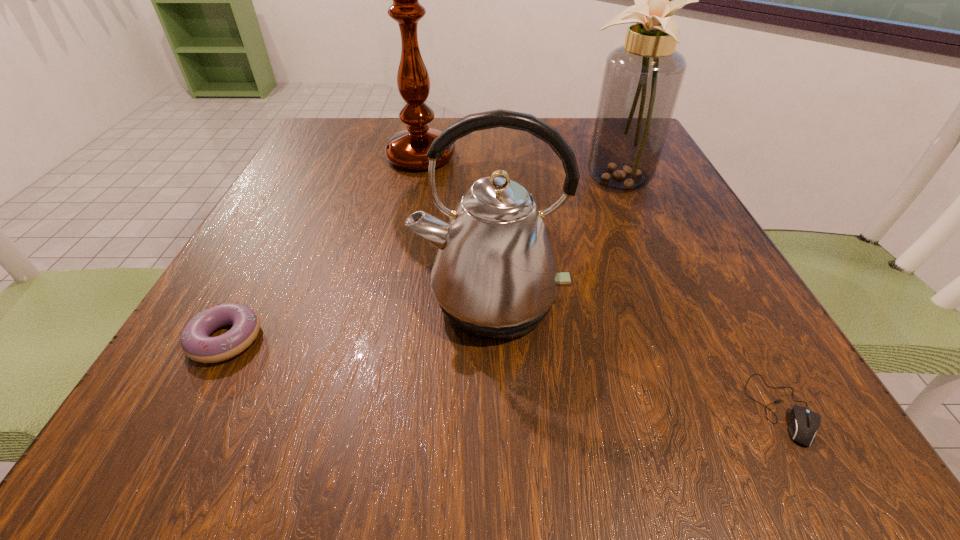
You are a GUI agent. You are given a task and a screenshot of the screen. Output one action in this format:
    pyautogui.click(x=<x>, y=<y>)
    Task: Click on the object located at the far right corner
    Image resolution: width=960 pixels, height=540 pixels.
    Given the screenshot: What is the action you would take?
    pyautogui.click(x=642, y=79)

Locate an element on the screen. The height and width of the screenshot is (540, 960). object positioned at the near right corner is located at coordinates (804, 423).

In order to click on vacant space at the far edge of the desktop in this screenshot , I will do `click(472, 157)`.

In the image, there is a desktop. Where is `vacant space at the near edge`? vacant space at the near edge is located at coordinates (579, 388).

The height and width of the screenshot is (540, 960). I want to click on vacant space at the left edge, so click(x=316, y=168).

Where is `free space at the right edge`? free space at the right edge is located at coordinates (690, 349).

This screenshot has height=540, width=960. I want to click on blank region between the second tallest object and the third tallest object, so click(x=553, y=238).

In order to click on free space between the nearest object and the doughnut in this screenshot , I will do pyautogui.click(x=504, y=374).

Locate an element on the screen. Image resolution: width=960 pixels, height=540 pixels. vacant space that is in between the shortest object and the flower arrangement is located at coordinates (699, 292).

At what (x,y) coordinates should I click in order to perform the action: click on free area in between the kettle and the nearest object. Please return your answer as a coordinate pair (x, y). The width and height of the screenshot is (960, 540). Looking at the image, I should click on (636, 355).